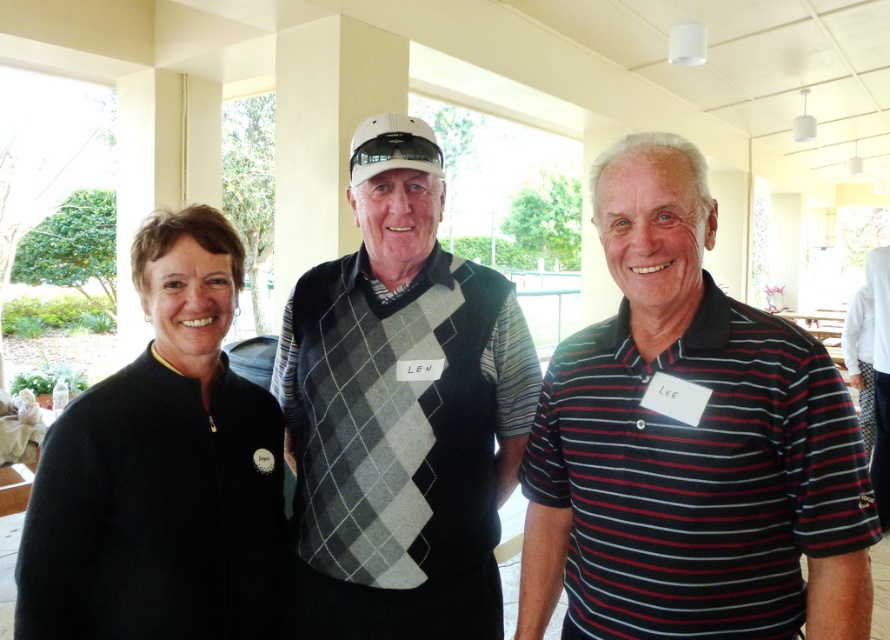
Based on the scene description, where is the striped cotton polo shirt at right located in terms of its 2D coordinates?

The striped cotton polo shirt at right is located at the 2D coordinates of point (689,444).

You are a photographer adjusting your camera settings to capture the group photo. You notice the striped cotton polo shirt at right and the argyle sweater vest at center. Which one is positioned nearer to the camera?

The striped cotton polo shirt at right is closer to the viewer than the argyle sweater vest at center, so the striped cotton polo shirt at right is nearer to the camera.